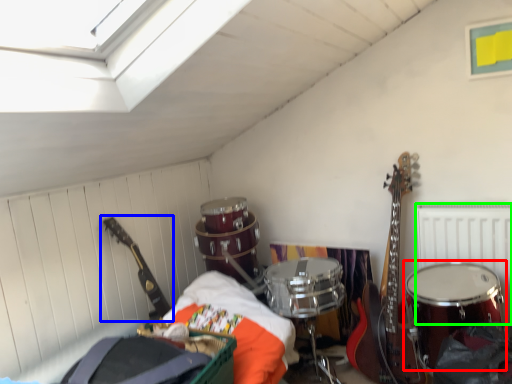
Question: Which is nearer to the drum (highlighted by a red box)? guitar (highlighted by a blue box) or radiator (highlighted by a green box).

Choices:
 (A) guitar
 (B) radiator

Answer: (B)